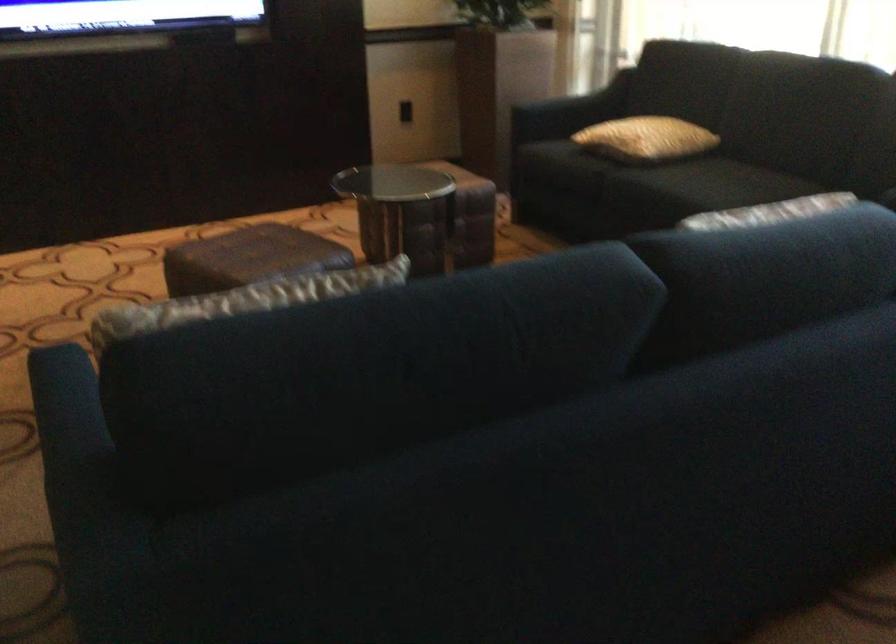
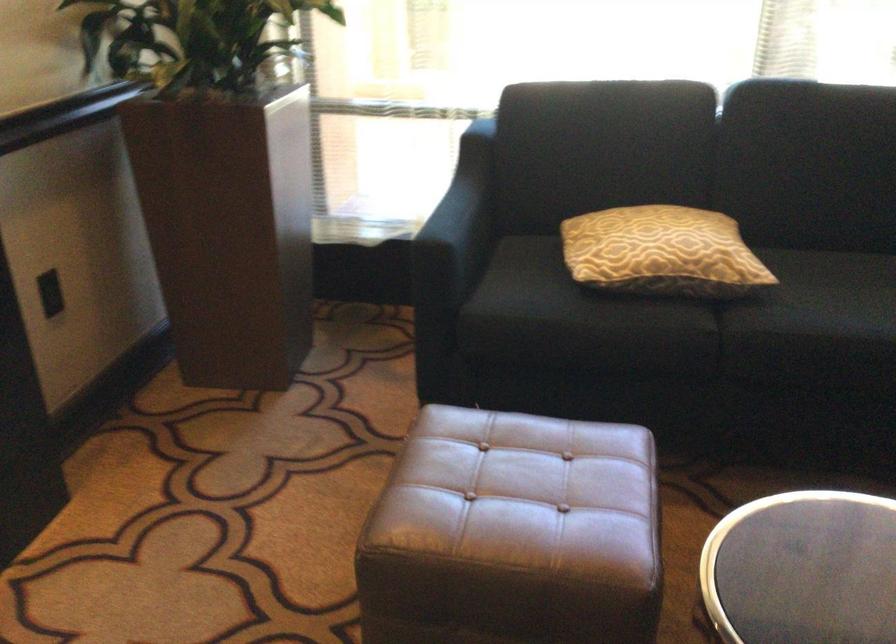
Find the pixel in the second image that matches [648,160] in the first image.

(752, 289)